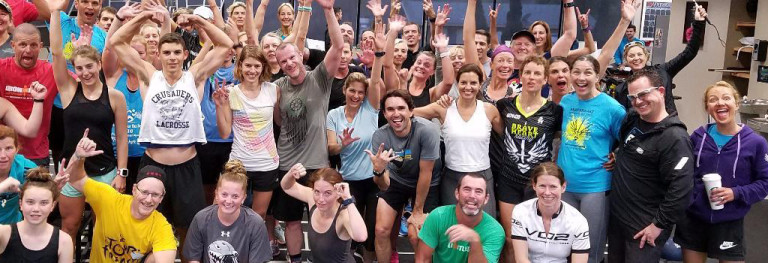
This screenshot has height=263, width=768. What are the coordinates of `door` in the screenshot? It's located at [x=713, y=44].